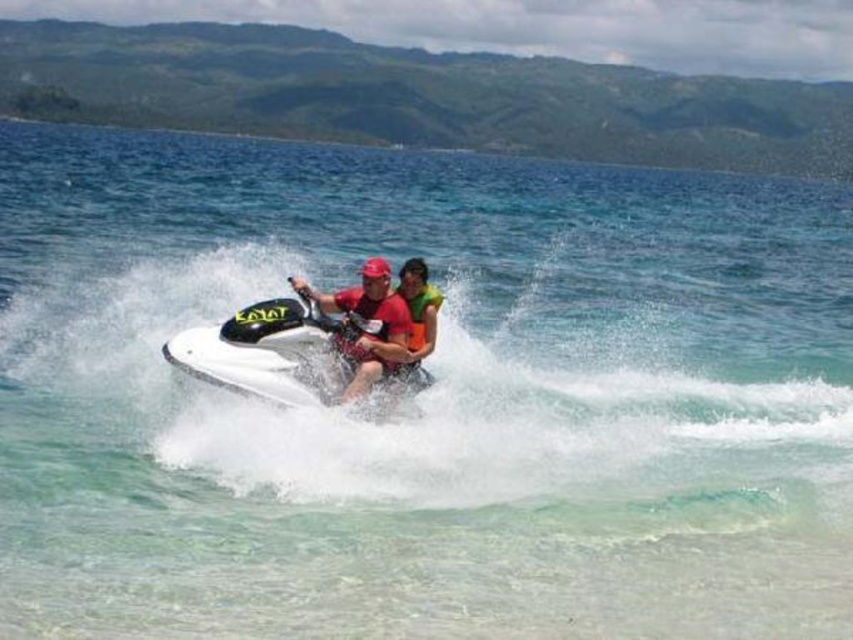
Question: Is white glossy jet ski at center further to the viewer compared to matte red shirt at center?

Choices:
 (A) no
 (B) yes

Answer: (A)

Question: Where is matte red shirt at center located in relation to green fabric life jacket at center in the image?

Choices:
 (A) below
 (B) above

Answer: (A)

Question: Does green fabric life jacket at center have a larger size compared to orange life vest at center?

Choices:
 (A) yes
 (B) no

Answer: (B)

Question: Which of these objects is positioned farthest from the matte red shirt at center?

Choices:
 (A) orange fabric life jacket at center
 (B) white glossy jet ski at center
 (C) orange life vest at center
 (D) green fabric life jacket at center

Answer: (B)

Question: Based on their relative distances, which object is nearer to the matte red shirt at center?

Choices:
 (A) orange life vest at center
 (B) orange fabric life jacket at center
 (C) white glossy jet ski at center
 (D) green fabric life jacket at center

Answer: (D)

Question: Which object appears farthest from the camera in this image?

Choices:
 (A) green fabric life jacket at center
 (B) matte red shirt at center
 (C) orange fabric life jacket at center

Answer: (C)